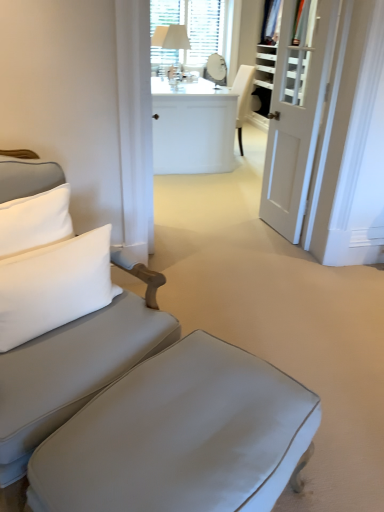
Question: Should I look upward or downward to see white glossy desk at center?

Choices:
 (A) up
 (B) down

Answer: (A)

Question: Considering the relative positions of matte gray ottoman at lower center and white glossy door at right in the image provided, is matte gray ottoman at lower center behind white glossy door at right?

Choices:
 (A) yes
 (B) no

Answer: (B)

Question: Is matte gray ottoman at lower center at the right side of white glossy door at right?

Choices:
 (A) no
 (B) yes

Answer: (A)

Question: Can you confirm if matte gray ottoman at lower center is shorter than white glossy door at right?

Choices:
 (A) yes
 (B) no

Answer: (A)

Question: Can you confirm if matte gray ottoman at lower center is wider than white glossy door at right?

Choices:
 (A) no
 (B) yes

Answer: (B)

Question: Would you say white glossy door at right is part of matte gray ottoman at lower center's contents?

Choices:
 (A) yes
 (B) no

Answer: (B)

Question: Considering the relative sizes of matte gray ottoman at lower center and white glossy door at right in the image provided, is matte gray ottoman at lower center taller than white glossy door at right?

Choices:
 (A) no
 (B) yes

Answer: (A)

Question: Is matte gray ottoman at lower center at the back of white glossy door at right?

Choices:
 (A) yes
 (B) no

Answer: (B)

Question: Can you confirm if white glossy door at right is positioned to the left of matte gray ottoman at lower center?

Choices:
 (A) no
 (B) yes

Answer: (A)

Question: Can you confirm if white glossy door at right is shorter than matte gray ottoman at lower center?

Choices:
 (A) yes
 (B) no

Answer: (B)

Question: Could you tell me if white glossy door at right is facing matte gray ottoman at lower center?

Choices:
 (A) yes
 (B) no

Answer: (B)

Question: Is white glossy door at right at the right side of matte gray ottoman at lower center?

Choices:
 (A) no
 (B) yes

Answer: (B)

Question: Considering the relative sizes of white glossy door at right and matte gray ottoman at lower center in the image provided, is white glossy door at right taller than matte gray ottoman at lower center?

Choices:
 (A) no
 (B) yes

Answer: (B)

Question: From the image's perspective, is matte gray ottoman at lower center located above white textured mirror at upper center?

Choices:
 (A) yes
 (B) no

Answer: (B)